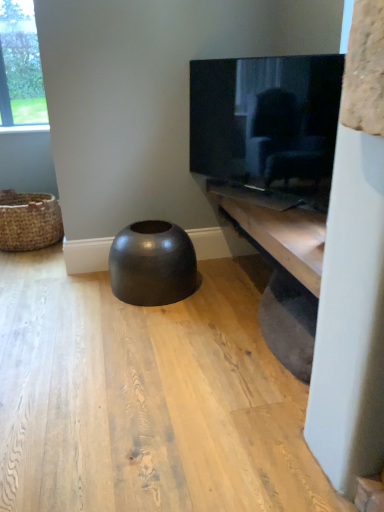
Question: Is brown woven basket at left located outside glossy black stool at center?

Choices:
 (A) no
 (B) yes

Answer: (B)

Question: Can glossy black stool at center be found inside brown woven basket at left?

Choices:
 (A) no
 (B) yes

Answer: (A)

Question: From a real-world perspective, is brown woven basket at left located higher than glossy black stool at center?

Choices:
 (A) no
 (B) yes

Answer: (B)

Question: Is brown woven basket at left far away from glossy black stool at center?

Choices:
 (A) yes
 (B) no

Answer: (A)

Question: Considering the relative sizes of brown woven basket at left and glossy black stool at center in the image provided, is brown woven basket at left bigger than glossy black stool at center?

Choices:
 (A) yes
 (B) no

Answer: (B)

Question: Can you confirm if brown woven basket at left is shorter than glossy black stool at center?

Choices:
 (A) yes
 (B) no

Answer: (B)

Question: Is wooden shelf at lower right shorter than brown woven basket at left?

Choices:
 (A) yes
 (B) no

Answer: (A)

Question: Is wooden shelf at lower right closer to camera compared to brown woven basket at left?

Choices:
 (A) no
 (B) yes

Answer: (B)

Question: From a real-world perspective, is wooden shelf at lower right on brown woven basket at left?

Choices:
 (A) yes
 (B) no

Answer: (A)

Question: Does wooden shelf at lower right have a greater height compared to brown woven basket at left?

Choices:
 (A) yes
 (B) no

Answer: (B)

Question: Is wooden shelf at lower right bigger than brown woven basket at left?

Choices:
 (A) no
 (B) yes

Answer: (B)

Question: From the image's perspective, is wooden shelf at lower right beneath brown woven basket at left?

Choices:
 (A) no
 (B) yes

Answer: (B)

Question: Is matte black tv at upper right to the left of glossy black stool at center from the viewer's perspective?

Choices:
 (A) yes
 (B) no

Answer: (B)